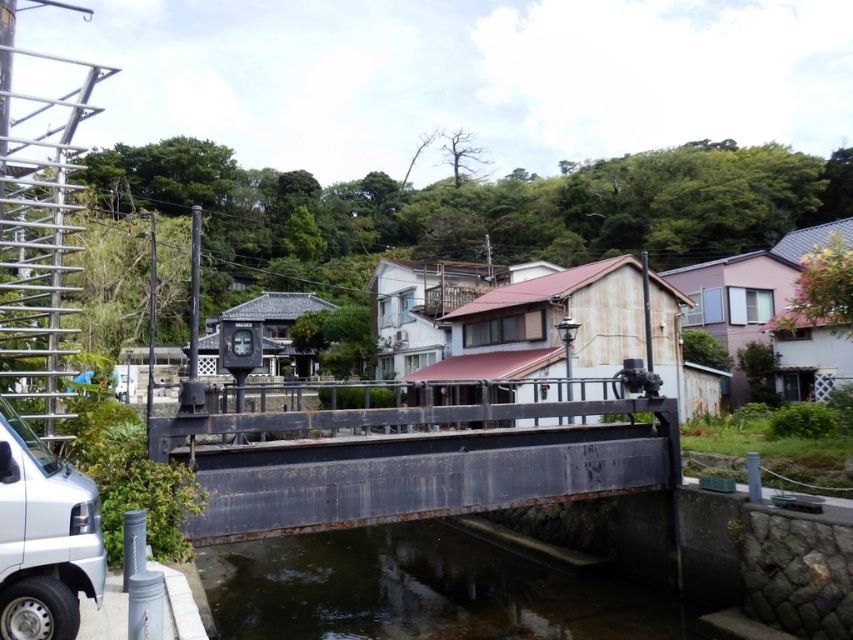
You are a delivery driver who needs to cross the rusty metal bridge at center with your silver metallic van at lower left. Based on the scene description, will the bridge be wide enough for your van to pass through safely?

The rusty metal bridge at center is wider than the silver metallic van at lower left, so the bridge should be wide enough for the van to pass safely.

In the scene shown: You are a delivery person who needs to cross the bridge to deliver a package to the house on the other side. The bridge is over the clear water at bridge center. Your van, the silver metallic van at lower left, is parked 19.03 feet away from the water. Is your van close enough to safely unload the package onto the bridge?

The distance between the clear water at bridge center and the silver metallic van at lower left is 19.03 feet. Since the van is parked near the bridge, this distance suggests it is close enough to safely unload the package onto the bridge.

You are a delivery driver who needs to drive your truck under the rusty metal bridge at center. There is also a silver metallic van at lower left parked nearby. Your truck is 3 meters tall. Can your truck pass under the bridge without hitting it?

The rusty metal bridge at center is taller than the silver metallic van at lower left. Since the van is at lower left and the bridge is taller, the truck can pass under the bridge as long as its height is less than the bridge clearance. However, without knowing the exact height of the bridge, we cannot confirm if the 3m truck will fit. The information provided only states the bridge is taller than the van, but not the van or bridge specific measurements.